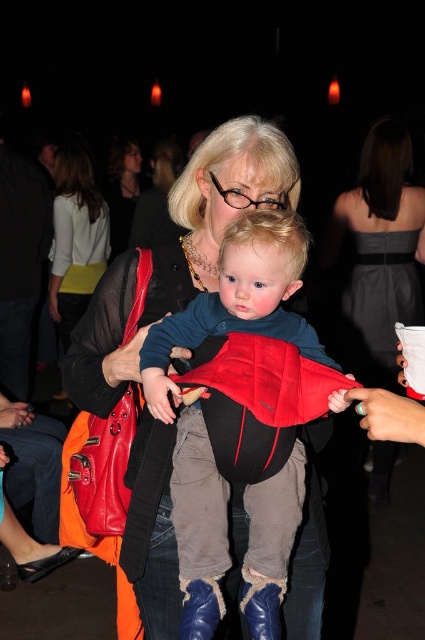
Which is behind, point (274, 561) or point (141, 160)?

Positioned behind is point (141, 160).

Who is more forward, (248, 230) or (129, 140)?

Point (248, 230) is more forward.

Is point (261, 522) closer to viewer compared to point (119, 192)?

Yes, point (261, 522) is closer to viewer.

Identify the location of matte black baby carrier at center. (203, 392).

What do you see at coordinates (203, 392) in the screenshot? I see `matte black baby carrier at center` at bounding box center [203, 392].

Is matte black baby carrier at center taller than gray satin dress at upper right?

No.

This screenshot has width=425, height=640. Describe the element at coordinates (203, 392) in the screenshot. I see `matte black baby carrier at center` at that location.

Find the location of `matte black baby carrier at center`. matte black baby carrier at center is located at coordinates (203, 392).

Measure the distance from gray satin dress at upper right to matte black jacket at upper center.

gray satin dress at upper right and matte black jacket at upper center are 9.55 feet apart.

Is point (374, 186) farther from viewer compared to point (121, 188)?

No.

The height and width of the screenshot is (640, 425). What do you see at coordinates (377, 253) in the screenshot?
I see `gray satin dress at upper right` at bounding box center [377, 253].

Locate an element on the screen. This screenshot has width=425, height=640. gray satin dress at upper right is located at coordinates (377, 253).